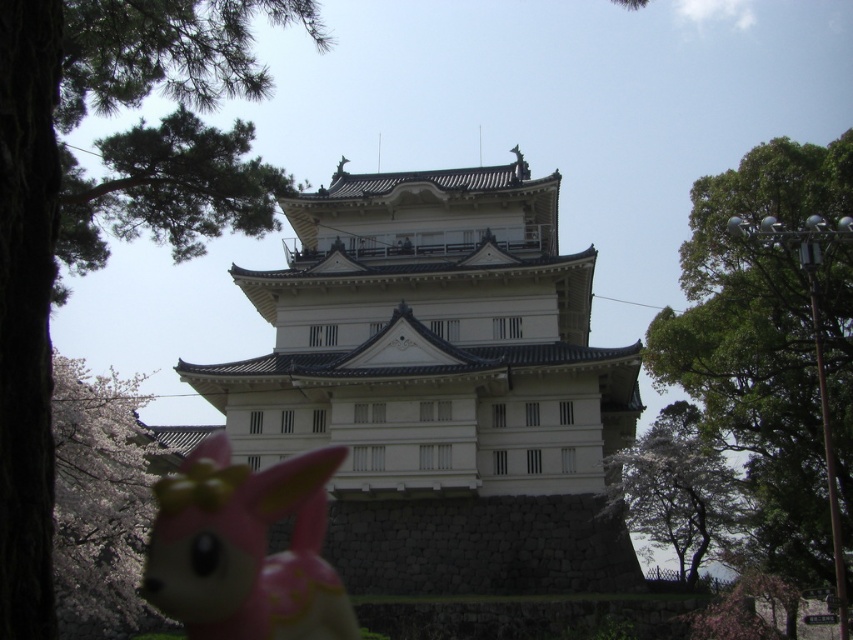
Question: Is green leafy tree at left further to the viewer compared to white textured tree at right?

Choices:
 (A) no
 (B) yes

Answer: (A)

Question: Which object appears farthest from the camera in this image?

Choices:
 (A) white blossoms at lower left
 (B) white textured tree at right
 (C) pink matte plush toy at lower left
 (D) green textured pine branch at upper left

Answer: (B)

Question: Among these points, which one is nearest to the camera?

Choices:
 (A) (132, 179)
 (B) (105, 621)

Answer: (A)

Question: Which point is closer to the camera taking this photo?

Choices:
 (A) (805, 481)
 (B) (9, 484)

Answer: (B)

Question: Does white stone tower at center have a lesser width compared to white blossoms at lower left?

Choices:
 (A) no
 (B) yes

Answer: (A)

Question: Where is green leafy tree at left located in relation to pink matte plush toy at lower left in the image?

Choices:
 (A) above
 (B) below

Answer: (A)